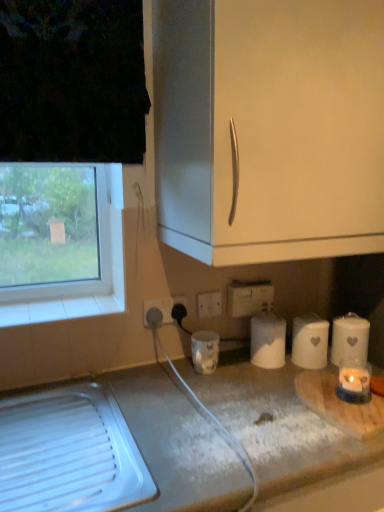
The width and height of the screenshot is (384, 512). Find the location of `vacant space that's between white matte paper towel at center, the third paper towel when ordered from right to left, and wooden cutting board at lower right`. vacant space that's between white matte paper towel at center, the third paper towel when ordered from right to left, and wooden cutting board at lower right is located at coordinates (274, 385).